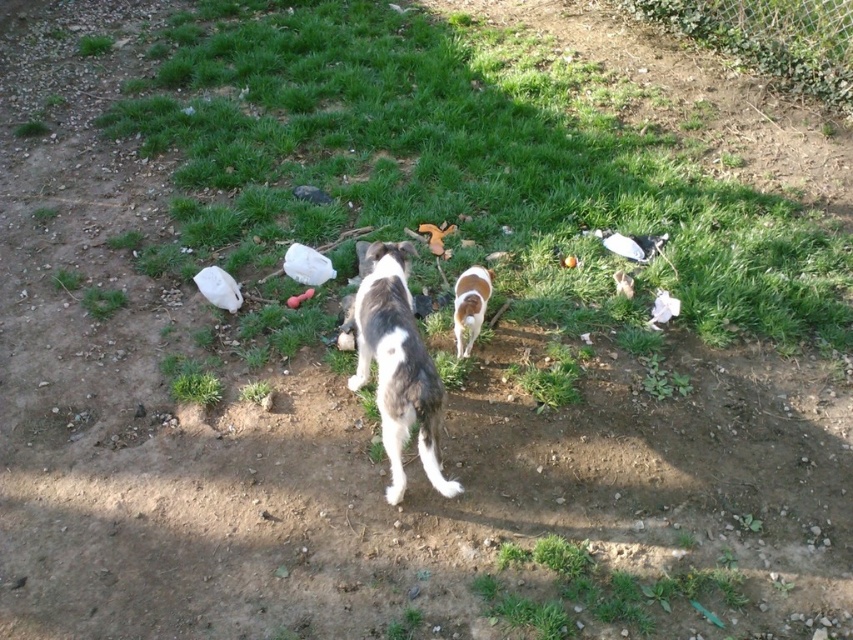
You are standing at the point marked as point (485, 300) and want to walk to the point marked as point (434, 394). Which direction should you face to move towards your destination?

You should face forward because point (434, 394) is in front of point (485, 300).

You are a photographer trying to capture a photo of both the white fur dog at center and the brown and white fur at center. Since you want the dogs to be in focus, which dog should you focus on first to ensure both are clear?

You should focus on the white fur dog at center first because it is closer to the viewer than the brown and white fur at center. By focusing on the closer dog, the farther dog will also be in focus due to the depth of field.